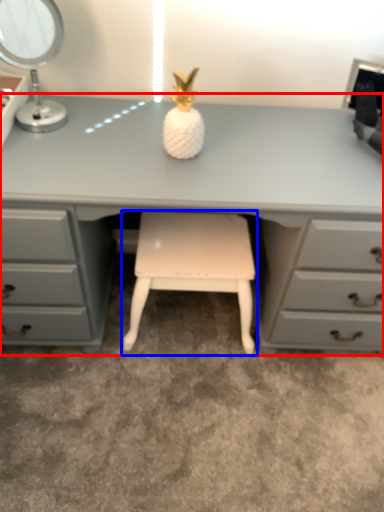
Question: Which object appears closest to the camera in this image, desk (highlighted by a red box) or stool (highlighted by a blue box)?

Choices:
 (A) desk
 (B) stool

Answer: (A)